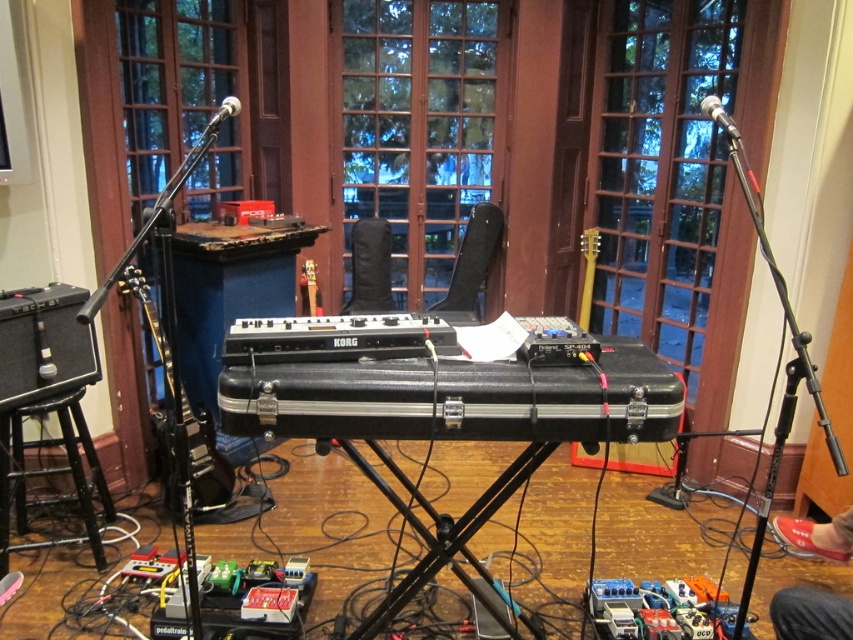
You are setting up a music studio and need to place a stand that requires at least 1 meter of vertical space. Given the black glossy electric guitar at left and the yellow matte guitar at center, which guitar would you choose to ensure the stand fits properly?

The black glossy electric guitar at left has a greater height compared to the yellow matte guitar at center, so choosing the black glossy electric guitar at left would provide the necessary vertical space for the stand.